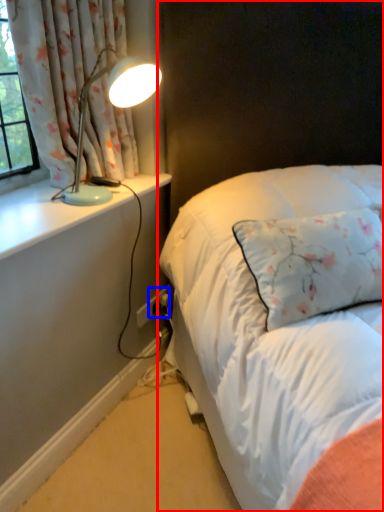
Question: Among these objects, which one is farthest to the camera, bed (highlighted by a red box) or electric outlet (highlighted by a blue box)?

Choices:
 (A) bed
 (B) electric outlet

Answer: (B)